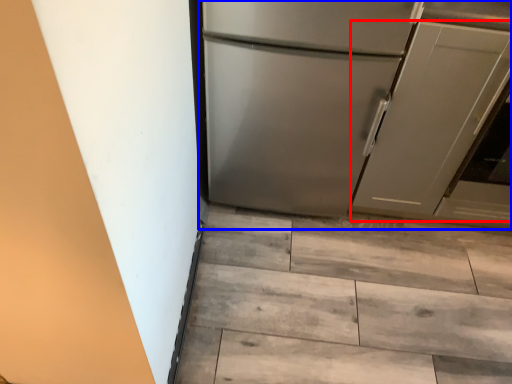
Question: Which object appears closest to the camera in this image, door (highlighted by a red box) or refrigerator (highlighted by a blue box)?

Choices:
 (A) door
 (B) refrigerator

Answer: (B)